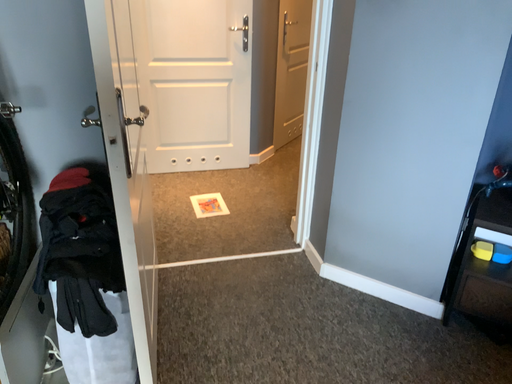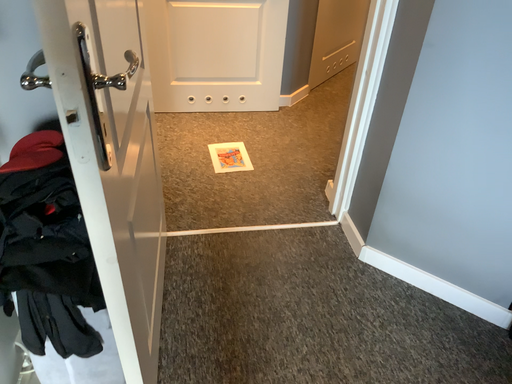
Question: How did the camera likely rotate when shooting the video?

Choices:
 (A) rotated upward
 (B) rotated downward

Answer: (B)